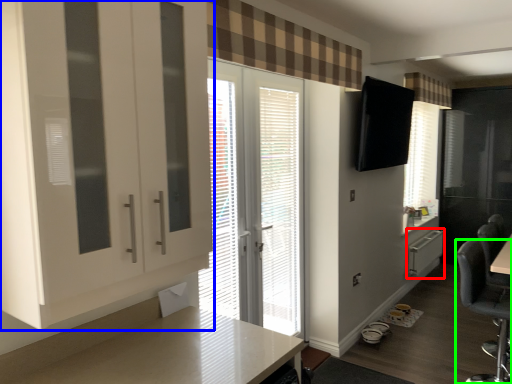
Question: Which object is the farthest from file cabinet (highlighted by a red box)? Choose among these: cabinetry (highlighted by a blue box) or chair (highlighted by a green box).

Choices:
 (A) cabinetry
 (B) chair

Answer: (A)